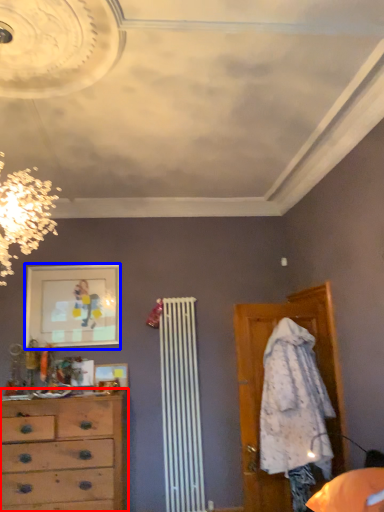
Question: Which object is further to the camera taking this photo, chest of drawers (highlighted by a red box) or picture frame (highlighted by a blue box)?

Choices:
 (A) chest of drawers
 (B) picture frame

Answer: (B)